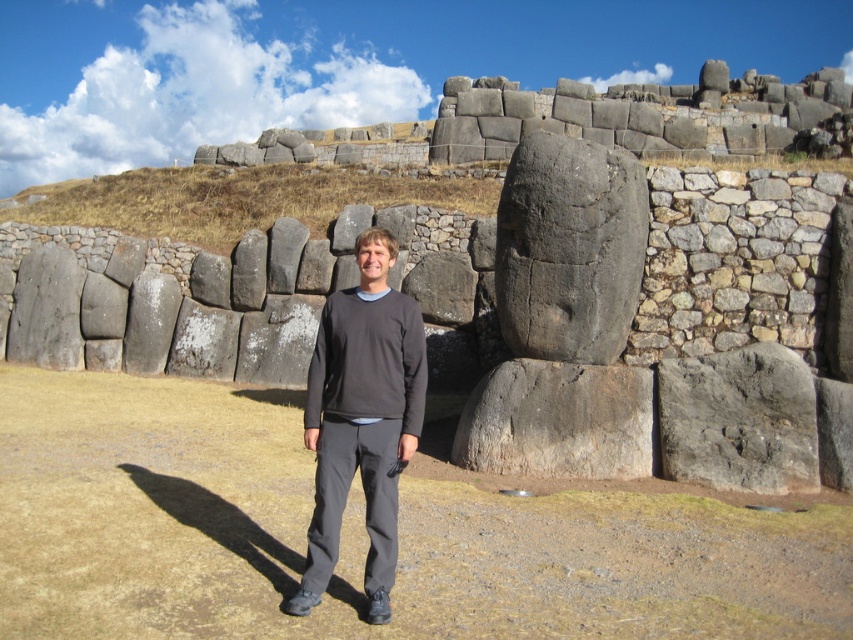
Question: Can you confirm if dark gray sweater at center is positioned to the right of gray rough stone boulder at center?

Choices:
 (A) yes
 (B) no

Answer: (B)

Question: Among these points, which one is farthest from the camera?

Choices:
 (A) coord(477,396)
 (B) coord(387,532)
 (C) coord(788,291)
 (D) coord(527,292)

Answer: (A)

Question: Is gray stone carving at center below gray rough stone boulder at center?

Choices:
 (A) yes
 (B) no

Answer: (B)

Question: Can you confirm if dark gray sweater at center is bigger than dark gray fleece sweatshirt at center?

Choices:
 (A) no
 (B) yes

Answer: (B)

Question: Which of these objects is positioned farthest from the dark gray sweater at center?

Choices:
 (A) gray rough stone boulder at center
 (B) dark gray fleece sweatshirt at center
 (C) gray stone statue at center

Answer: (C)

Question: Among these objects, which one is farthest from the camera?

Choices:
 (A) gray stone carving at center
 (B) dark gray sweater at center
 (C) gray stone statue at center
 (D) gray rough stone boulder at center

Answer: (A)